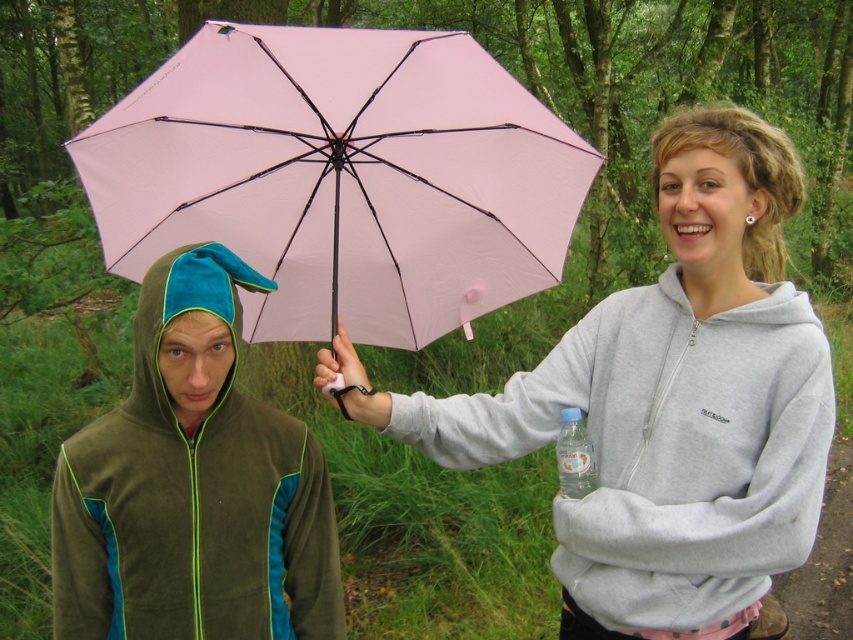
Is matte pink umbrella at upper center above olive fleece jacket at left?

Indeed, matte pink umbrella at upper center is positioned over olive fleece jacket at left.

Between matte pink umbrella at upper center and olive fleece jacket at left, which one appears on the right side from the viewer's perspective?

From the viewer's perspective, matte pink umbrella at upper center appears more on the right side.

Where is `matte pink umbrella at upper center`? matte pink umbrella at upper center is located at coordinates (666, 404).

What are the coordinates of `matte pink umbrella at upper center` in the screenshot? It's located at (666, 404).

Is pink matte umbrella at upper center shorter than clear plastic bottle at lower center?

No, pink matte umbrella at upper center is not shorter than clear plastic bottle at lower center.

Consider the image. Which is below, pink matte umbrella at upper center or clear plastic bottle at lower center?

clear plastic bottle at lower center is below.

Who is more forward, (403, 314) or (566, 429)?

Point (566, 429) is more forward.

The width and height of the screenshot is (853, 640). Find the location of `pink matte umbrella at upper center`. pink matte umbrella at upper center is located at coordinates (341, 177).

Is matte pink umbrella at upper center above clear plastic bottle at lower center?

Indeed, matte pink umbrella at upper center is positioned over clear plastic bottle at lower center.

Who is positioned more to the right, matte pink umbrella at upper center or clear plastic bottle at lower center?

matte pink umbrella at upper center

Find the location of a particular element. The width and height of the screenshot is (853, 640). matte pink umbrella at upper center is located at coordinates (666, 404).